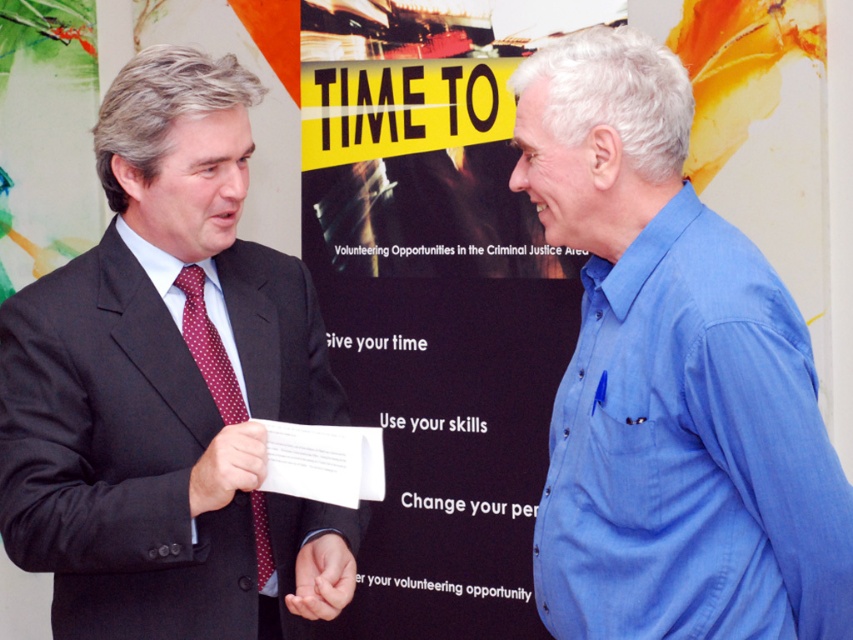
Question: Based on their relative distances, which object is farther from the blue denim shirt at right?

Choices:
 (A) matte black suit at left
 (B) polka dot silk tie at left
 (C) smooth skin hand at center

Answer: (B)

Question: Does matte black suit at left appear under matte red tie at center?

Choices:
 (A) yes
 (B) no

Answer: (B)

Question: Among these objects, which one is nearest to the camera?

Choices:
 (A) polka dot silk tie at left
 (B) matte black suit at left

Answer: (B)

Question: Which object is the closest to the polka dot silk tie at left?

Choices:
 (A) matte black suit at left
 (B) smooth skin hand at center
 (C) blue denim shirt at right
 (D) matte red tie at center

Answer: (A)

Question: Is matte black suit at left below matte red tie at center?

Choices:
 (A) no
 (B) yes

Answer: (A)

Question: Can you confirm if polka dot silk tie at left is positioned to the right of matte red tie at center?

Choices:
 (A) yes
 (B) no

Answer: (B)